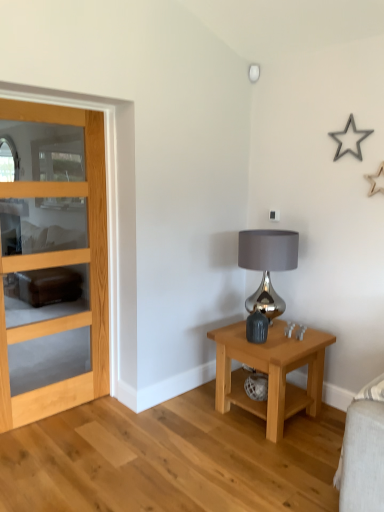
Find the location of a particular element. free space in front of light wood/glass door at left is located at coordinates (56, 455).